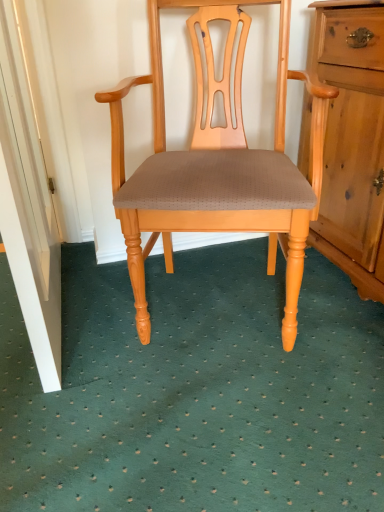
Question: Is white painted wood door at lower left in front of or behind light wood/finely carvedchair at center in the image?

Choices:
 (A) front
 (B) behind

Answer: (A)

Question: From the image's perspective, relative to light wood/finely carvedchair at center, is white painted wood door at lower left above or below?

Choices:
 (A) below
 (B) above

Answer: (B)

Question: In terms of width, does white painted wood door at lower left look wider or thinner when compared to light wood/finely carvedchair at center?

Choices:
 (A) thin
 (B) wide

Answer: (A)

Question: Is light wood/finely carvedchair at center inside or outside of white painted wood door at lower left?

Choices:
 (A) inside
 (B) outside

Answer: (B)

Question: Looking at their shapes, would you say light wood/finely carvedchair at center is wider or thinner than white painted wood door at lower left?

Choices:
 (A) wide
 (B) thin

Answer: (A)

Question: Looking at the image, does light wood/finely carvedchair at center seem bigger or smaller compared to white painted wood door at lower left?

Choices:
 (A) big
 (B) small

Answer: (A)

Question: From a real-world perspective, is light wood/finely carvedchair at center above or below white painted wood door at lower left?

Choices:
 (A) above
 (B) below

Answer: (B)